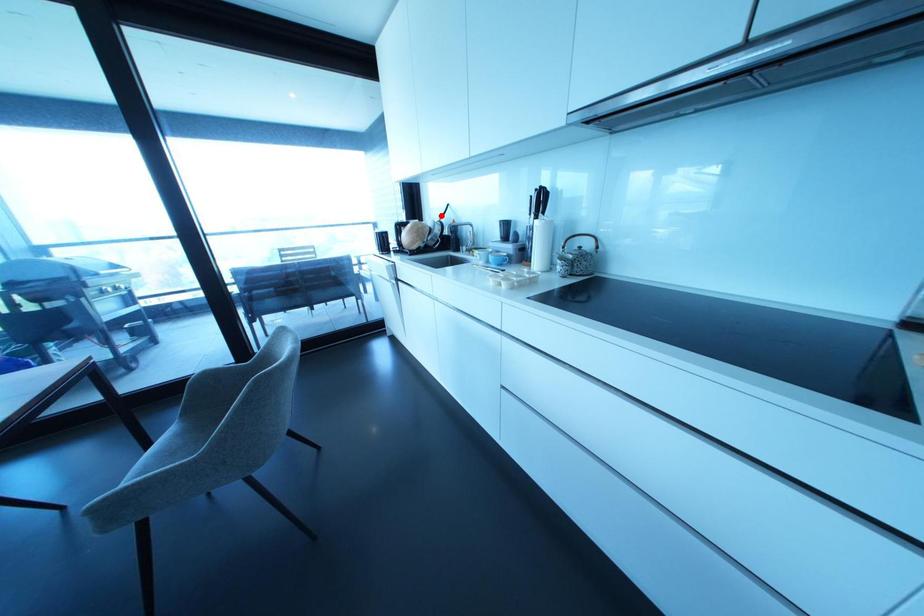
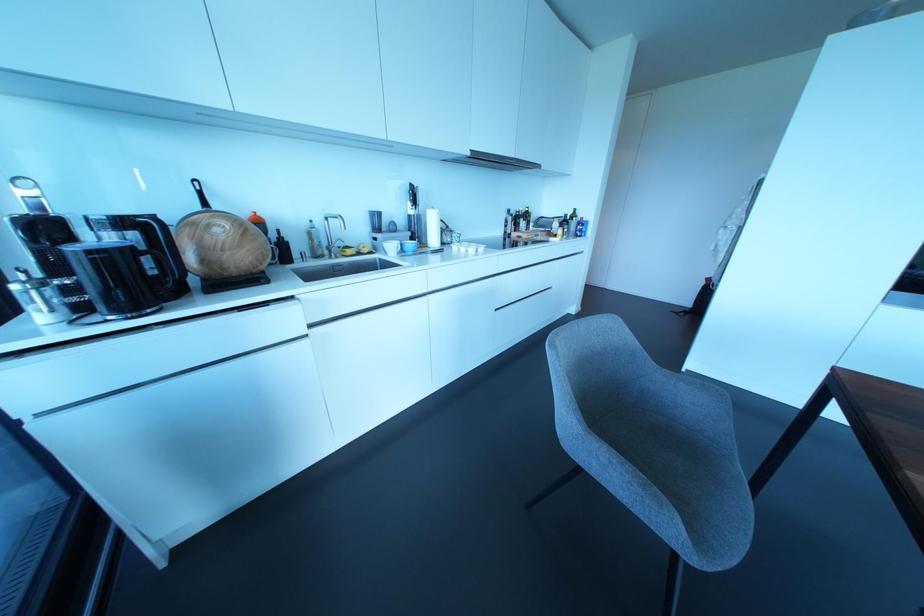
Question: I am providing you with two images of the same scene from different viewpoints. A red point is shown in image1. For the corresponding object point in image2, is it positioned nearer or farther from the camera?

Choices:
 (A) Nearer
 (B) Farther

Answer: (B)